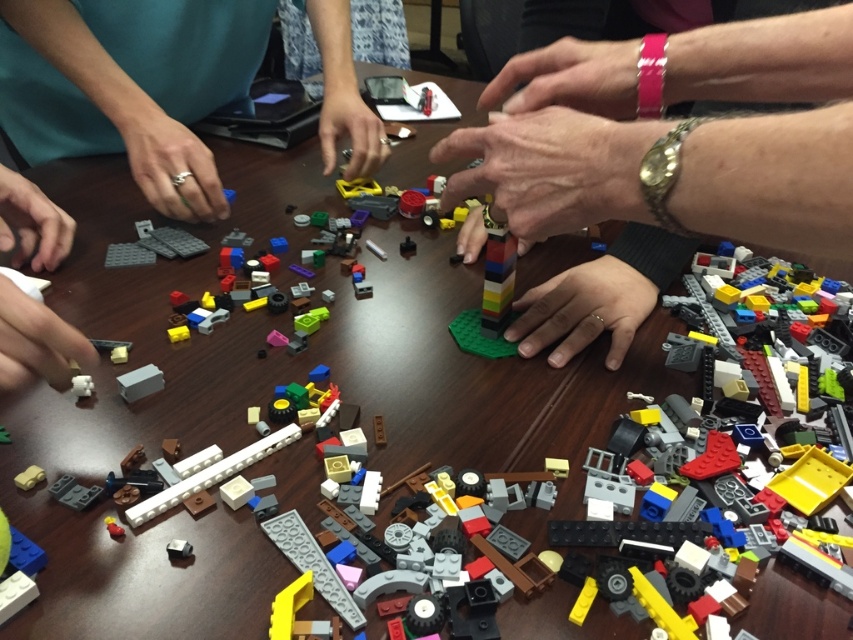
Question: Does gold ring at left appear on the right side of white matte plastic hand at lower left?

Choices:
 (A) no
 (B) yes

Answer: (A)

Question: Does smooth metallic watch at center come in front of white matte cube at center?

Choices:
 (A) yes
 (B) no

Answer: (A)

Question: Among these objects, which one is nearest to the camera?

Choices:
 (A) white matte plastic hand at lower left
 (B) matte black finger at lower left

Answer: (A)

Question: Can you confirm if white matte plastic hand at lower left is wider than white matte cube at center?

Choices:
 (A) yes
 (B) no

Answer: (A)

Question: Which point is closer to the camera?

Choices:
 (A) matte plastic hand at center
 (B) white matte cube at center

Answer: (B)

Question: Among these points, which one is nearest to the camera?

Choices:
 (A) (361, 116)
 (B) (570, 134)
 (C) (19, 385)

Answer: (C)